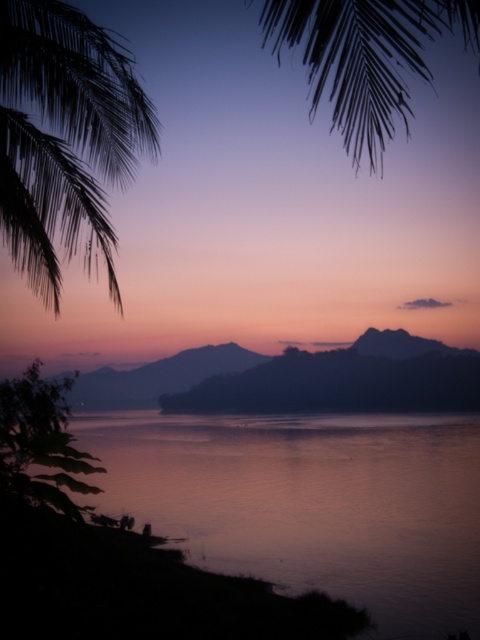
Does smooth water at lower center have a greater width compared to silky black palm fronds at upper left?

In fact, smooth water at lower center might be narrower than silky black palm fronds at upper left.

The image size is (480, 640). I want to click on smooth water at lower center, so click(310, 502).

Does smooth water at lower center have a greater height compared to silky black palm leaf at upper center?

In fact, smooth water at lower center may be shorter than silky black palm leaf at upper center.

Does smooth water at lower center come behind silky black palm leaf at upper center?

Yes, smooth water at lower center is behind silky black palm leaf at upper center.

The image size is (480, 640). Identify the location of smooth water at lower center. (310, 502).

Who is more forward, (78,221) or (430,26)?

Point (78,221) is in front.

Find the location of `silky black palm fronds at upper left`. silky black palm fronds at upper left is located at coordinates (63, 134).

At what (x,y) coordinates should I click in order to perform the action: click on silky black palm fronds at upper left. Please return your answer as a coordinate pair (x, y). Looking at the image, I should click on (63, 134).